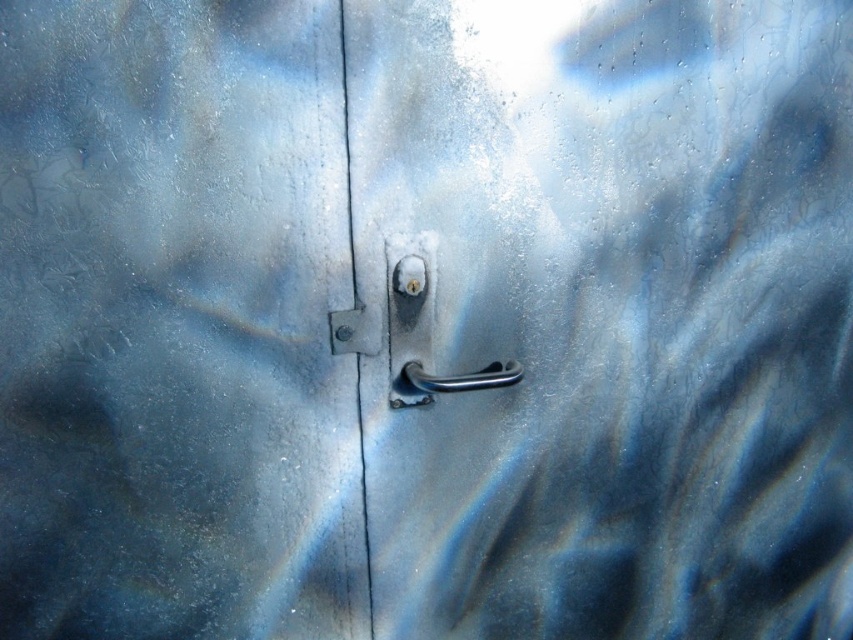
Question: Which of the following is the farthest from the observer?

Choices:
 (A) satin silver lock at center
 (B) metallic silver handle at center
 (C) satin silver handle at center
 (D) polished metal handle at center

Answer: (A)

Question: Does polished metal handle at center have a greater width compared to satin silver lock at center?

Choices:
 (A) yes
 (B) no

Answer: (A)

Question: Is metallic silver handle at center bigger than satin silver handle at center?

Choices:
 (A) no
 (B) yes

Answer: (B)

Question: Which object is closer to the camera taking this photo?

Choices:
 (A) polished metal handle at center
 (B) satin silver handle at center
 (C) satin silver lock at center
 (D) metallic silver handle at center

Answer: (D)

Question: Is metallic silver handle at center behind satin silver handle at center?

Choices:
 (A) no
 (B) yes

Answer: (A)

Question: Based on their relative distances, which object is farther from the metallic silver handle at center?

Choices:
 (A) satin silver handle at center
 (B) satin silver lock at center
 (C) polished metal handle at center

Answer: (B)